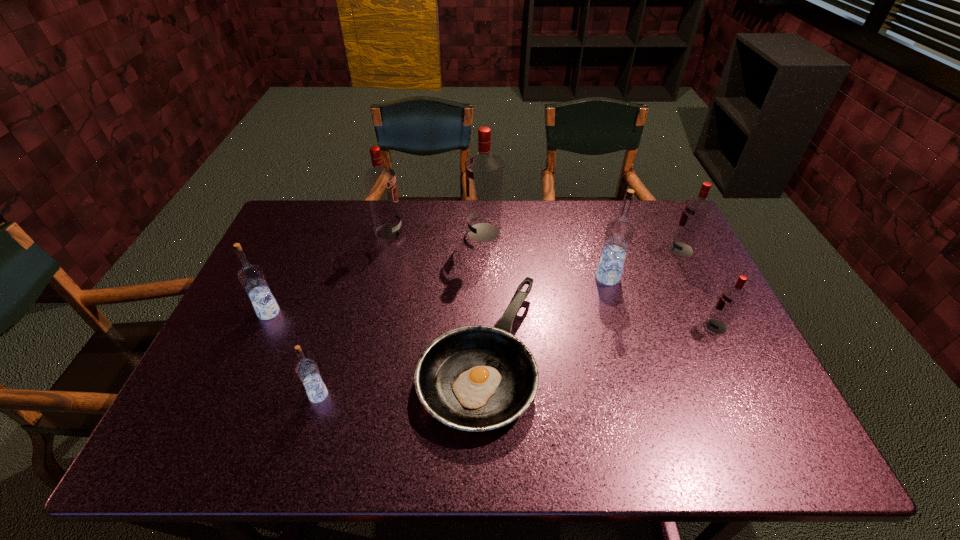
Locate an element on the screen. the biggest red vodka is located at coordinates (483, 170).

Identify the location of the fourth vodka from right to left. (483, 170).

Identify the location of the second biggest red vodka. (380, 181).

The image size is (960, 540). In order to click on the fifth vodka from right to left in this screenshot , I will do `click(380, 181)`.

Locate an element on the screen. This screenshot has width=960, height=540. the fifth nearest object is located at coordinates (619, 233).

Where is `the third object from right to left`? the third object from right to left is located at coordinates (619, 233).

Where is `the second biggest blue vodka`? This screenshot has height=540, width=960. the second biggest blue vodka is located at coordinates (251, 277).

The width and height of the screenshot is (960, 540). Identify the location of the leftmost vodka. pos(251,277).

Locate an element on the screen. the second smallest red vodka is located at coordinates (696, 211).

Image resolution: width=960 pixels, height=540 pixels. I want to click on the smallest red vodka, so click(732, 297).